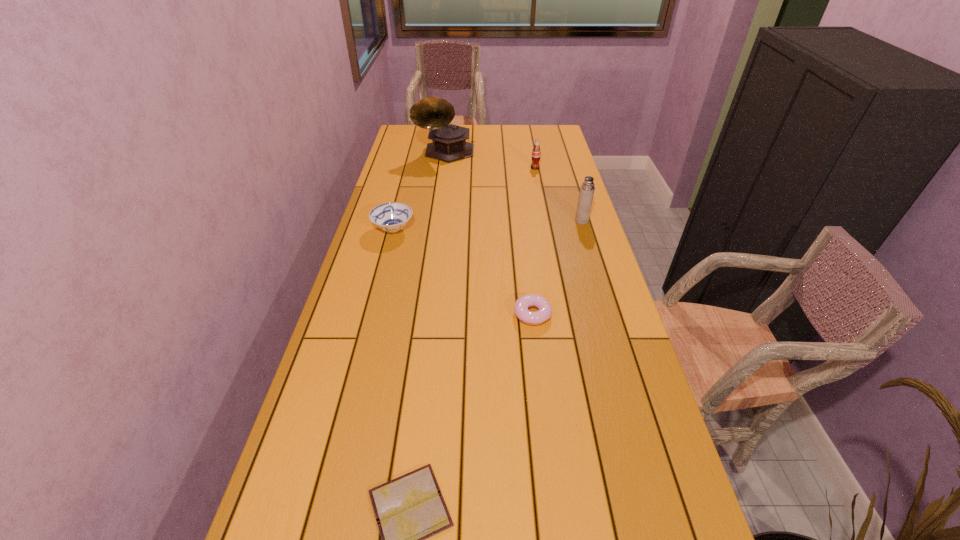
Select which object is the fifth closest to the diary. Please provide its 2D coordinates. Your answer should be formatted as a tuple, i.e. [(x, y)], where the tuple contains the x and y coordinates of a point satisfying the conditions above.

[(449, 144)]

Where is `object that is the closest one to the phonograph record`? object that is the closest one to the phonograph record is located at coordinates (536, 153).

Where is `vacant position in the image that satisfies the following two spatial constraints: 1. on the horn direction of the phonograph record; 2. on the right side of the second tallest object`? This screenshot has height=540, width=960. vacant position in the image that satisfies the following two spatial constraints: 1. on the horn direction of the phonograph record; 2. on the right side of the second tallest object is located at coordinates (437, 221).

Where is `free spot that satisfies the following two spatial constraints: 1. on the front side of the third shortest object; 2. on the left side of the second nearest object`? free spot that satisfies the following two spatial constraints: 1. on the front side of the third shortest object; 2. on the left side of the second nearest object is located at coordinates (372, 314).

This screenshot has height=540, width=960. Identify the location of vacant point that satisfies the following two spatial constraints: 1. on the back side of the soup bowl; 2. on the right side of the soda. (409, 168).